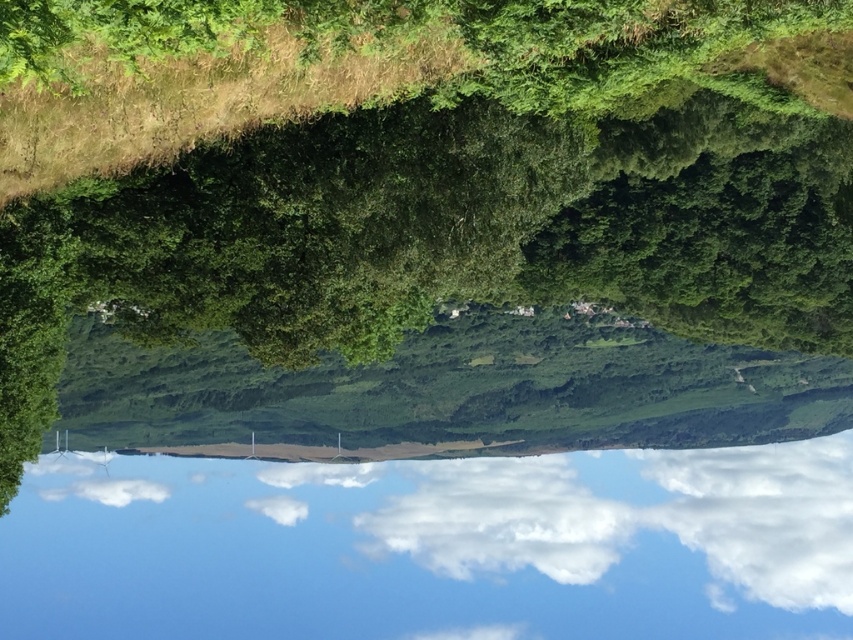
Between green leafy tree at upper center and transparent glass water at center, which one is positioned lower?

transparent glass water at center is lower down.

Is point (177, 216) closer to viewer compared to point (730, 497)?

Yes, it is in front of point (730, 497).

The image size is (853, 640). What are the coordinates of `green leafy tree at upper center` in the screenshot? It's located at (442, 291).

Can you confirm if white fluffy cloud at upper center is positioned to the left of white fluffy cloud at center?

In fact, white fluffy cloud at upper center is to the right of white fluffy cloud at center.

Can you confirm if white fluffy cloud at upper center is taller than white fluffy cloud at center?

Yes, white fluffy cloud at upper center is taller than white fluffy cloud at center.

Is point (817, 522) closer to camera compared to point (488, 525)?

No, (817, 522) is further to viewer.

This screenshot has width=853, height=640. I want to click on white fluffy cloud at upper center, so click(x=763, y=515).

Consider the image. Which is more to the left, transparent glass water at center or white fluffy cloud at upper center?

From the viewer's perspective, transparent glass water at center appears more on the left side.

Is transparent glass water at center above white fluffy cloud at upper center?

No.

Looking at this image, who is more distant from viewer, [490,483] or [708,548]?

Positioned behind is point [708,548].

What are the coordinates of `transparent glass water at center` in the screenshot? It's located at (434, 545).